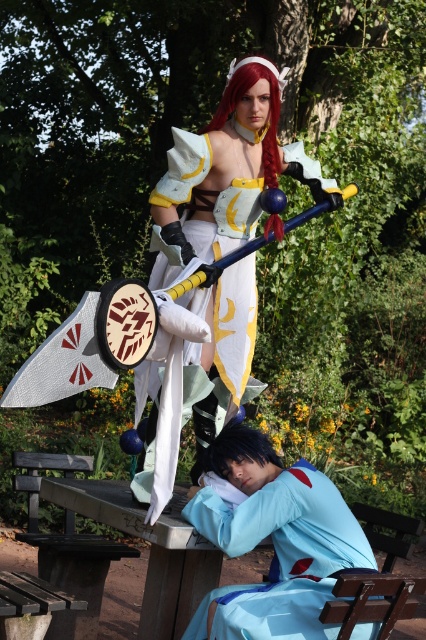
You are planning to take a photo of the two outfits in the park. The white satin dress at center and the light blue fabric at lower center are both in frame. Which outfit has a wider silhouette when viewed from the front?

The white satin dress at center has a wider silhouette than the light blue fabric at lower center because its width is larger as described.

You are an artist trying to sketch the scene described. To ensure accuracy, you need to know the exact position of the white satin dress at center. Can you determine its coordinates based on the scene description?

The white satin dress at center is located at coordinates point (227, 173).

You are organizing a fashion show and need to determine which garment takes up more space on the runway. Based on the scene, which item is bigger between the white satin dress at center and the light blue fabric at lower center?

The white satin dress at center is larger in size than the light blue fabric at lower center, so the white satin dress at center takes up more space on the runway.